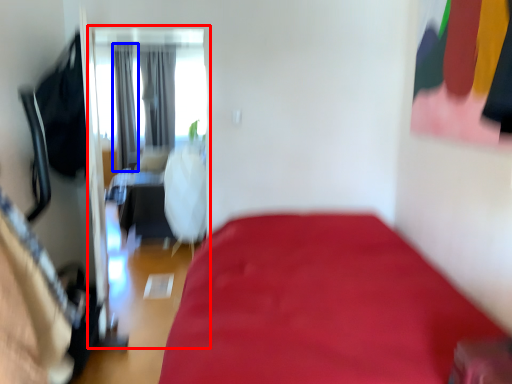
Question: Among these objects, which one is nearest to the camera, screen door (highlighted by a red box) or curtain (highlighted by a blue box)?

Choices:
 (A) screen door
 (B) curtain

Answer: (A)